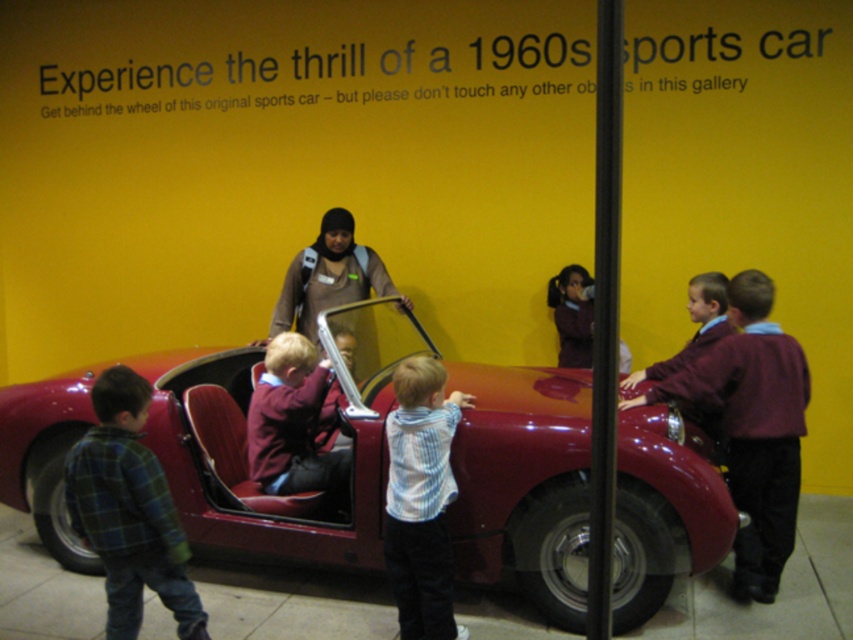
Consider the image. You are a tour guide in the museum and need to ensure that the children are at least 3 feet away from the vintage car for safety. Are the children wearing the green plaid shirt at lower left and the shiny red car at center within the required distance?

The shiny red car at center and green plaid shirt at lower left are 3.49 feet apart, which exceeds the 3 feet requirement. Therefore, the children are within the safe distance.

You are a tour guide at the museum and want to explain the size difference between the shiny red car at center and the maroon fabric jacket at center to visitors. How would you describe their sizes?

The shiny red car at center is bigger than the maroon fabric jacket at center, so the car takes up more space in the scene compared to the jacket.

You are a photographer at the museum and want to take a photo of the green plaid shirt at lower left and the striped shirt at center without any obstruction. Based on their positions, which child should be moved so that both are visible clearly?

The green plaid shirt at lower left is in front of striped shirt at center. To ensure both are visible without obstruction, the green plaid shirt at lower left should be moved to the side so the striped shirt at center can be seen behind.